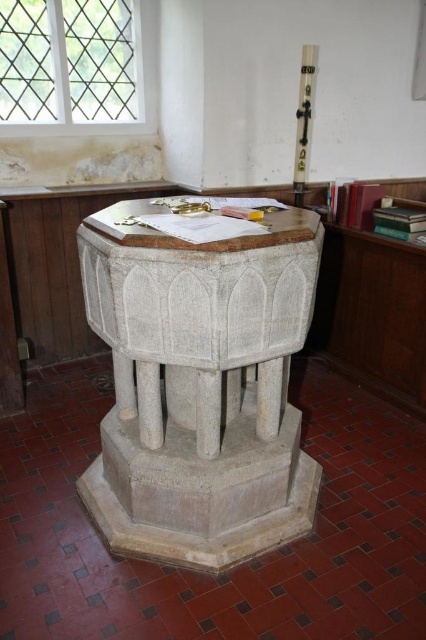
Question: Does white stone baptismal font at center appear under white polished wood cross at upper right?

Choices:
 (A) no
 (B) yes

Answer: (B)

Question: Is white stone baptismal font at center thinner than white polished wood cross at upper right?

Choices:
 (A) yes
 (B) no

Answer: (B)

Question: Among these points, which one is nearest to the camera?

Choices:
 (A) (196, 497)
 (B) (307, 88)

Answer: (A)

Question: Observing the image, what is the correct spatial positioning of white stone baptismal font at center in reference to white polished wood cross at upper right?

Choices:
 (A) left
 (B) right

Answer: (A)